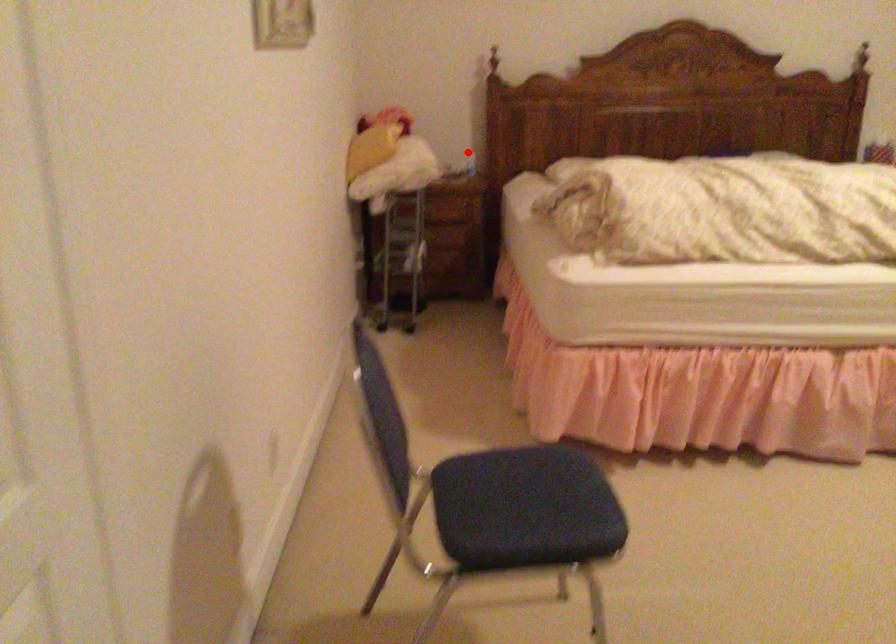
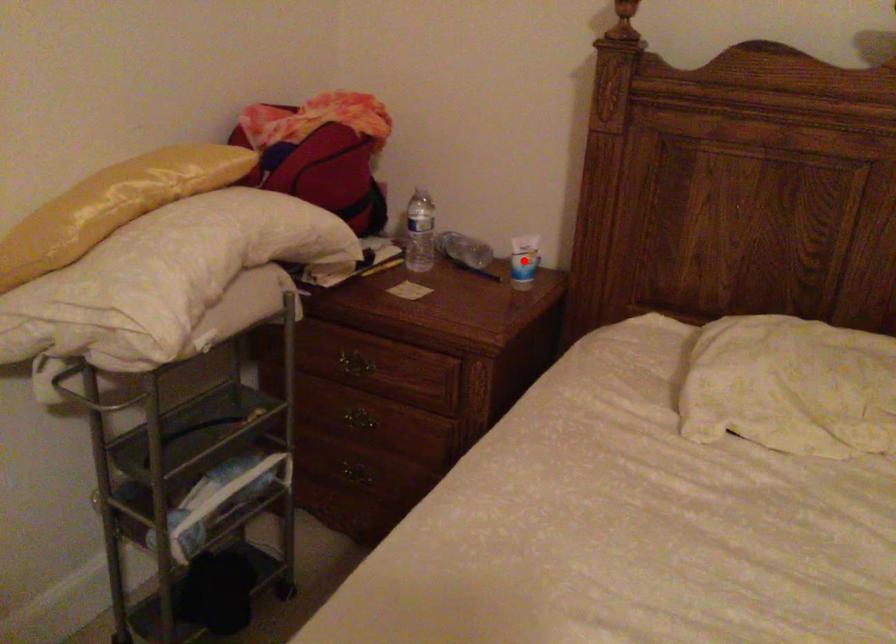
I am providing you with two images of the same scene from different viewpoints. A red point is marked on the first image and another point is marked on the second image. Does the point marked in image1 correspond to the same location as the one in image2?

Yes